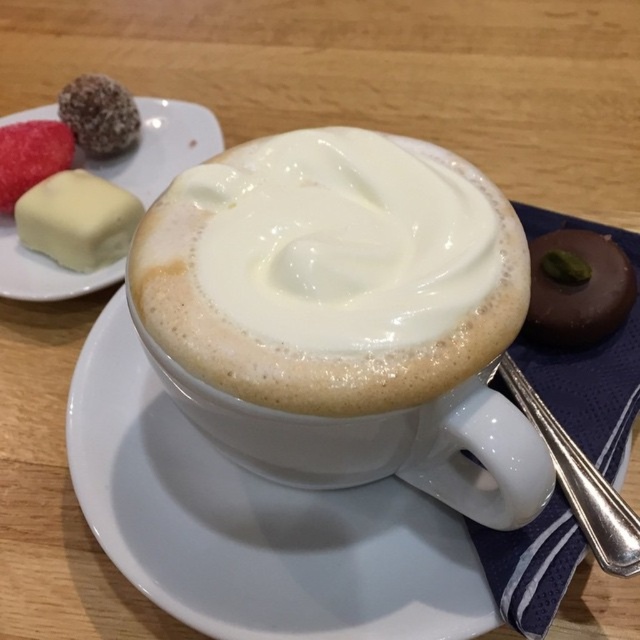
You are a customer at the cafe and want to reach for the white cream cheese at upper left. Which direction should you move your hand from the white frothy coffee at center?

You should move your hand to the left from the white frothy coffee at center to reach the white cream cheese at upper left because the white frothy coffee at center is located to the right of the white cream cheese at upper left.

You are a barista arranging items on a counter. You have a white matte plate at upper left and a white cream cheese at upper left. Which item has a greater width?

The white matte plate at upper left has a greater width than the white cream cheese at upper left.

You are a barista preparing a dessert plate for a customer. You have a white frothy coffee at center and a white cream cheese at upper left. Which item should you place closer to the customer to ensure visibility?

The white frothy coffee at center should be placed closer to the customer because it is larger in size than the white cream cheese at upper left, making it more noticeable.